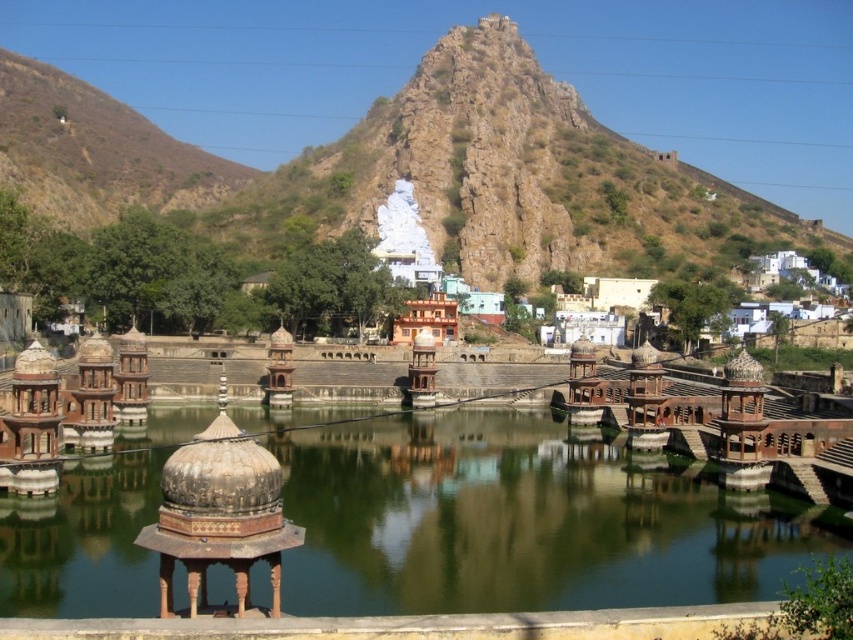
Does rustic stone mountain at upper center have a greater height compared to greenish water at center?

Correct, rustic stone mountain at upper center is much taller as greenish water at center.

Is rustic stone mountain at upper center to the left of greenish water at center from the viewer's perspective?

Indeed, rustic stone mountain at upper center is positioned on the left side of greenish water at center.

Which is behind, point (473, 131) or point (585, 586)?

The point (473, 131) is behind.

Locate an element on the screen. This screenshot has height=640, width=853. rustic stone mountain at upper center is located at coordinates (393, 166).